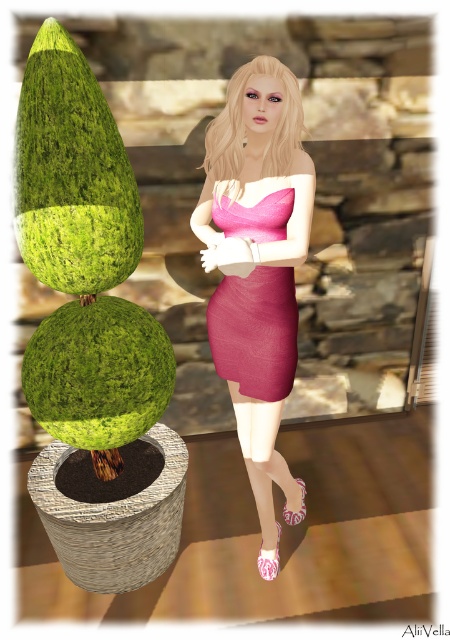
Question: Which point appears closest to the camera in this image?

Choices:
 (A) (238, 410)
 (B) (274, 376)

Answer: (B)

Question: Which object appears farthest from the camera in this image?

Choices:
 (A) pink matte dress at center
 (B) pink satin dress at center

Answer: (A)

Question: Observing the image, what is the correct spatial positioning of pink satin dress at center in reference to pink matte dress at center?

Choices:
 (A) below
 (B) above

Answer: (A)

Question: Is pink satin dress at center to the left of pink matte dress at center from the viewer's perspective?

Choices:
 (A) no
 (B) yes

Answer: (A)

Question: Can you confirm if pink satin dress at center is positioned above pink matte dress at center?

Choices:
 (A) no
 (B) yes

Answer: (A)